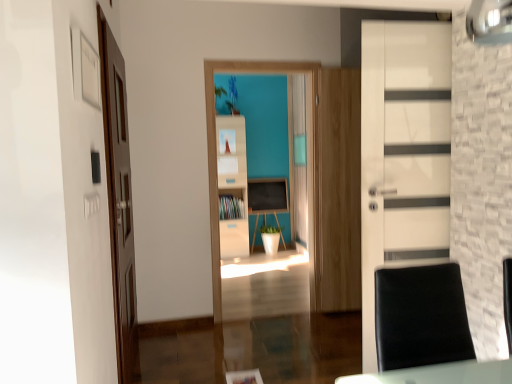
Where is `free spot above white matte bookshelf at center (from a real-world perspective)`? free spot above white matte bookshelf at center (from a real-world perspective) is located at coordinates [263, 54].